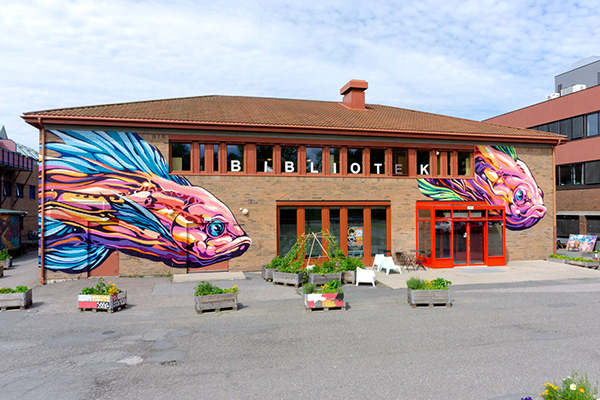
The width and height of the screenshot is (600, 400). Identify the location of fish painting. (156, 224), (520, 196).